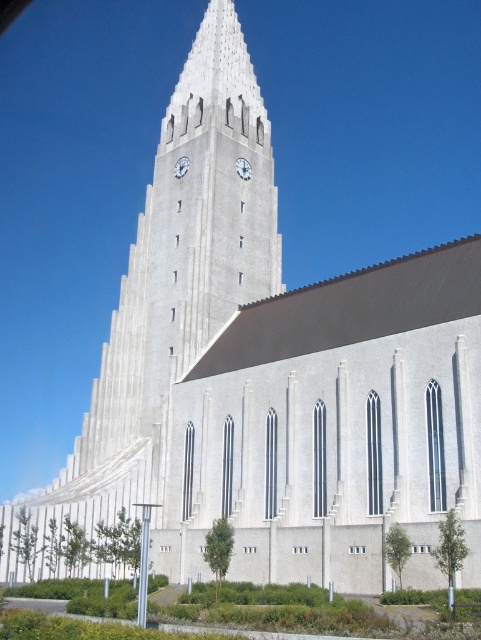
Question: Is white metallic clock at upper center to the right of white glossy clock at upper center from the viewer's perspective?

Choices:
 (A) no
 (B) yes

Answer: (B)

Question: Does white metallic clock at upper center have a smaller size compared to white glossy clock at upper center?

Choices:
 (A) yes
 (B) no

Answer: (B)

Question: Which of the following is the closest to the observer?

Choices:
 (A) white metallic clock at upper center
 (B) white glossy clock at upper center

Answer: (B)

Question: Does white metallic clock at upper center have a greater width compared to white glossy clock at upper center?

Choices:
 (A) yes
 (B) no

Answer: (A)